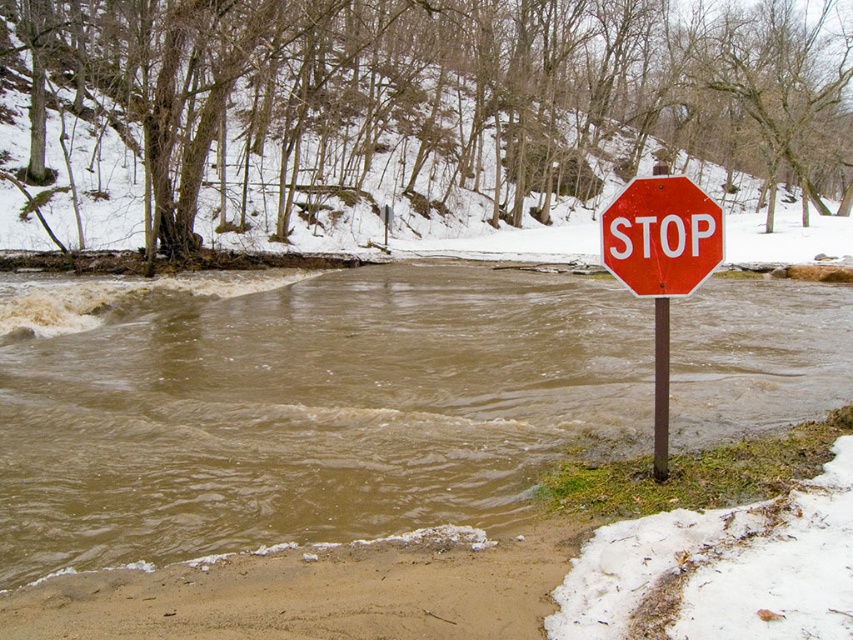
Who is higher up, brown muddy water at lower left or red glossy stop sign at right?

brown muddy water at lower left is higher up.

Is brown muddy water at lower left thinner than red glossy stop sign at right?

Incorrect, brown muddy water at lower left's width is not less than red glossy stop sign at right's.

Is point (350, 483) positioned after point (647, 195)?

Yes, point (350, 483) is farther from viewer.

This screenshot has width=853, height=640. Find the location of `brown muddy water at lower left`. brown muddy water at lower left is located at coordinates (306, 412).